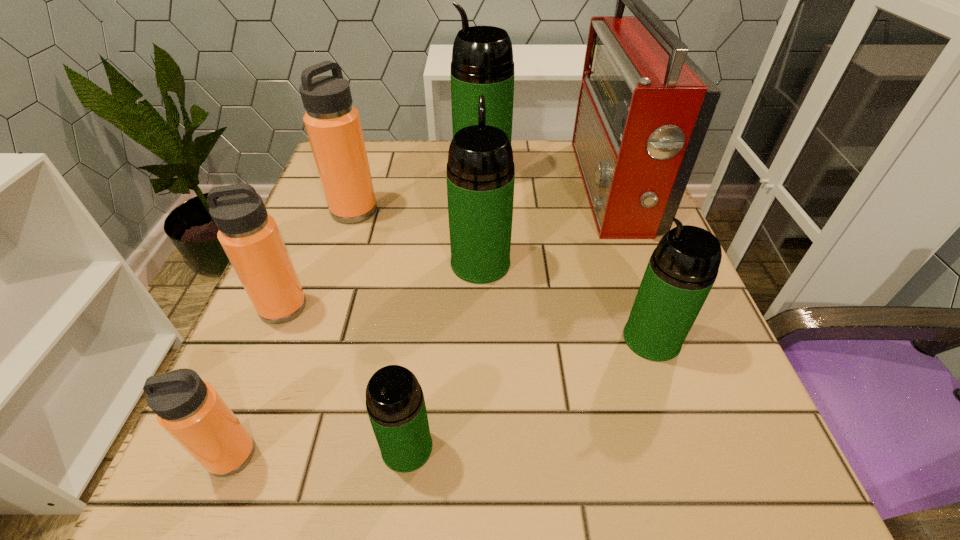
Locate an element on the screen. the farthest green thermos bottle is located at coordinates (482, 63).

This screenshot has height=540, width=960. I want to click on the farthest thermos bottle, so click(x=482, y=63).

Find the location of a particular element. The width and height of the screenshot is (960, 540). radio receiver is located at coordinates (644, 108).

Find the location of a particular element. the second biggest green thermos bottle is located at coordinates (480, 174).

Identify the location of the third nearest green thermos bottle. The height and width of the screenshot is (540, 960). (480, 174).

This screenshot has height=540, width=960. I want to click on the sixth nearest thermos bottle, so click(x=333, y=126).

At what (x,y) coordinates should I click in order to perform the action: click on the farthest orange thermos bottle. Please return your answer as a coordinate pair (x, y). The height and width of the screenshot is (540, 960). Looking at the image, I should click on (333, 126).

Locate an element on the screen. This screenshot has width=960, height=540. the second nearest orange thermos bottle is located at coordinates (250, 237).

At what (x,y) coordinates should I click in order to perform the action: click on the second smallest green thermos bottle. Please return your answer as a coordinate pair (x, y). Looking at the image, I should click on (682, 269).

You are a GUI agent. You are given a task and a screenshot of the screen. Output one action in this format:
    pyautogui.click(x=<x>, y=<y>)
    Task: Click on the rightmost thermos bottle
    This screenshot has height=540, width=960.
    Given the screenshot: What is the action you would take?
    pyautogui.click(x=682, y=269)